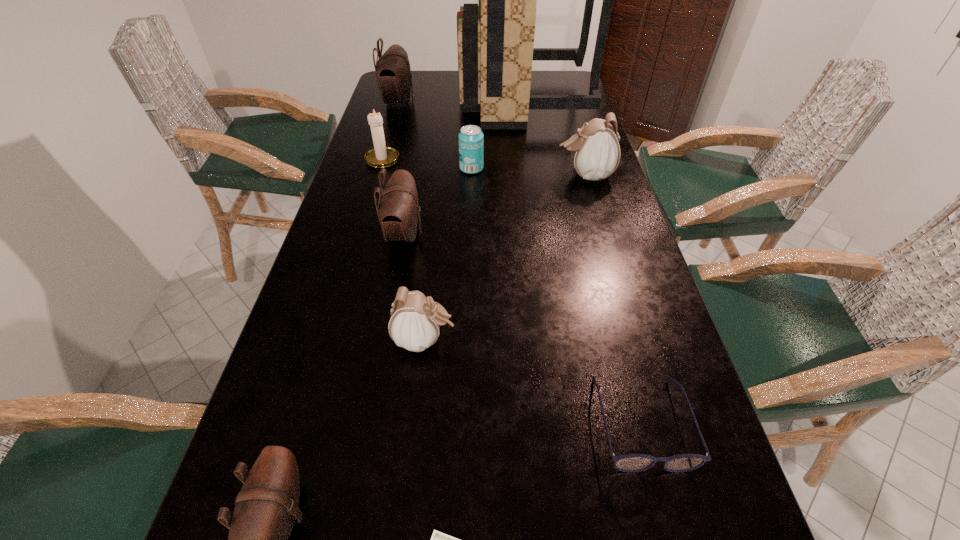
Locate an element on the screen. vacant space situated 0.170m on the handle side of the candle holder is located at coordinates (394, 122).

Locate an element on the screen. The width and height of the screenshot is (960, 540). vacant area situated on the handle side of the candle holder is located at coordinates (389, 138).

Locate an element on the screen. vacant space located on the handle side of the candle holder is located at coordinates (397, 106).

Identify the location of free space located on the front-facing side of the smaller white pouch. Image resolution: width=960 pixels, height=540 pixels. (481, 340).

Locate an element on the screen. vacant region located on the front of the beer can is located at coordinates (471, 190).

Where is `backpack situated at the far edge`? The width and height of the screenshot is (960, 540). backpack situated at the far edge is located at coordinates (495, 40).

You are a GUI agent. You are given a task and a screenshot of the screen. Output one action in this format:
    pyautogui.click(x=<x>, y=<y>)
    Task: Click on the pouch present at the far edge
    The height and width of the screenshot is (540, 960).
    Given the screenshot: What is the action you would take?
    pyautogui.click(x=393, y=73)

You are a GUI agent. You are given a task and a screenshot of the screen. Output one action in this format:
    pyautogui.click(x=<x>, y=<y>)
    Task: Click on the candle holder located at the left edge
    The image size is (960, 540).
    Given the screenshot: What is the action you would take?
    pyautogui.click(x=380, y=156)

Where is `backpack that is at the right edge`? The height and width of the screenshot is (540, 960). backpack that is at the right edge is located at coordinates (495, 40).

Where is `pouch situated at the right edge`? pouch situated at the right edge is located at coordinates (595, 149).